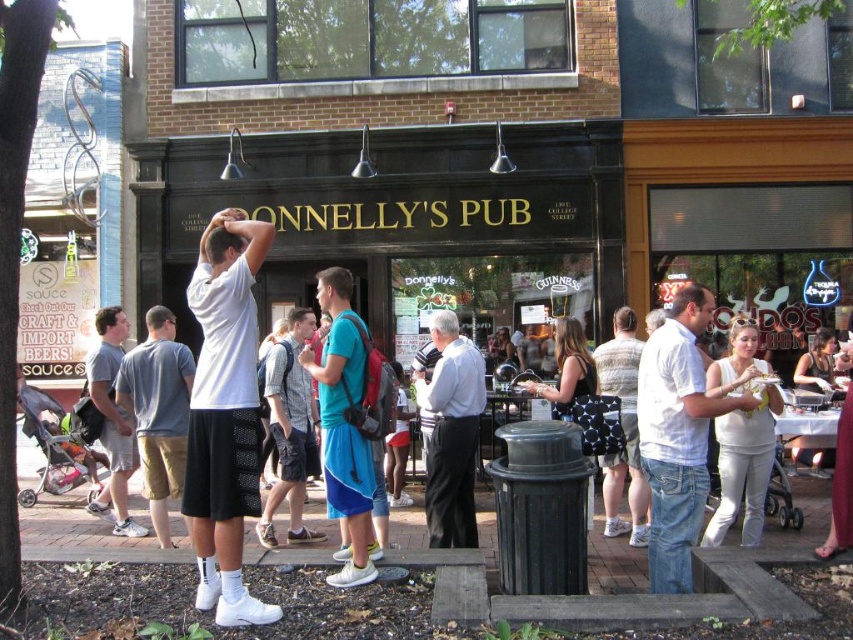
Question: Which object is positioned closest to the gray wool suit at center?

Choices:
 (A) gray cotton t-shirt at left
 (B) blue fabric backpack at center
 (C) white cotton shirt at center

Answer: (B)

Question: Can you confirm if blue fabric backpack at center is positioned above gray wool suit at center?

Choices:
 (A) no
 (B) yes

Answer: (B)

Question: Can you confirm if gray wool suit at center is wider than denim shorts at center?

Choices:
 (A) yes
 (B) no

Answer: (B)

Question: Which of the following is the closest to the observer?

Choices:
 (A) denim shorts at center
 (B) white matte shorts at center
 (C) gray cotton shorts at lower left
 (D) gray wool suit at center

Answer: (B)

Question: Which point is closer to the camera?

Choices:
 (A) blue fabric backpack at center
 (B) gray cotton t-shirt at left
 (C) denim shorts at center

Answer: (A)

Question: Does blue fabric backpack at center have a smaller size compared to gray cotton shorts at lower left?

Choices:
 (A) no
 (B) yes

Answer: (A)